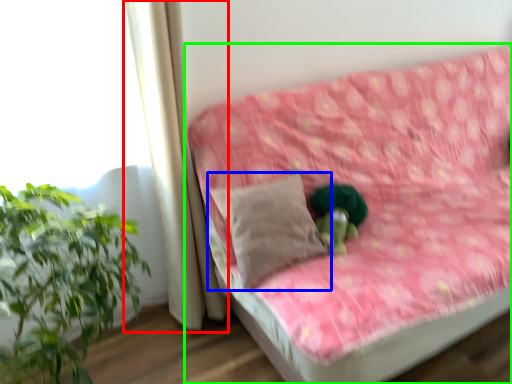
Question: Considering the real-world distances, which object is farthest from curtain (highlighted by a red box)? pillow (highlighted by a blue box) or studio couch (highlighted by a green box)?

Choices:
 (A) pillow
 (B) studio couch

Answer: (B)